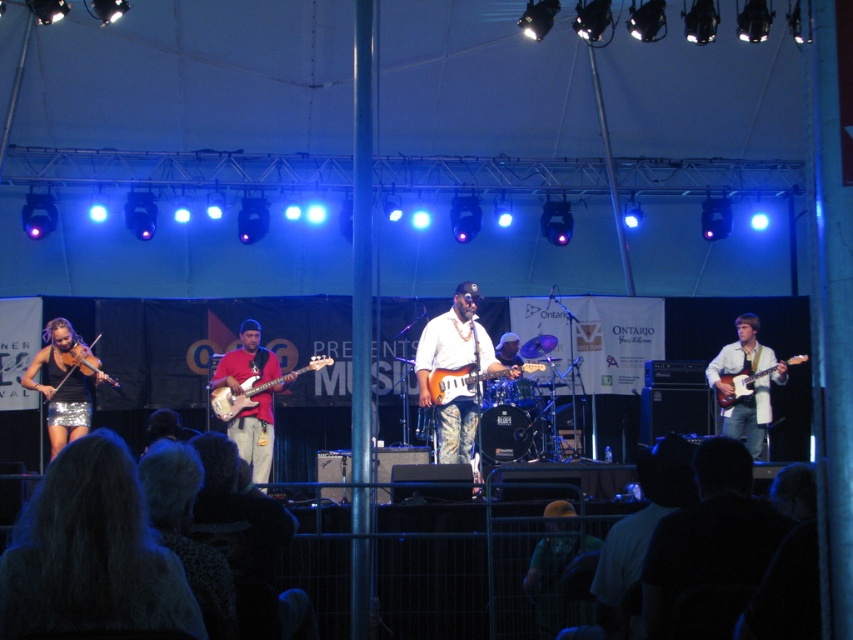
Does red matte guitar at center appear on the left side of matte red electric bass at center?

Correct, you'll find red matte guitar at center to the left of matte red electric bass at center.

What do you see at coordinates (256, 433) in the screenshot? The height and width of the screenshot is (640, 853). I see `red matte guitar at center` at bounding box center [256, 433].

Find the location of a particular element. The image size is (853, 640). red matte guitar at center is located at coordinates (256, 433).

Where is `red matte guitar at center`? Image resolution: width=853 pixels, height=640 pixels. red matte guitar at center is located at coordinates (256, 433).

What do you see at coordinates (752, 384) in the screenshot? The image size is (853, 640). I see `white glossy guitar at center` at bounding box center [752, 384].

Does white glossy guitar at center have a larger size compared to shiny orange electric guitar at center?

Correct, white glossy guitar at center is larger in size than shiny orange electric guitar at center.

Which is in front, point (759, 432) or point (468, 368)?

Positioned in front is point (468, 368).

What are the coordinates of `white glossy guitar at center` in the screenshot? It's located at (752, 384).

Locate an element on the screen. This screenshot has height=640, width=853. white glossy guitar at center is located at coordinates (752, 384).

Can you confirm if white glossy guitar at center is shorter than matte red electric bass at center?

No, white glossy guitar at center is not shorter than matte red electric bass at center.

Is point (721, 365) positioned in front of point (245, 397)?

No.

Find the location of `white glossy guitar at center`. white glossy guitar at center is located at coordinates (752, 384).